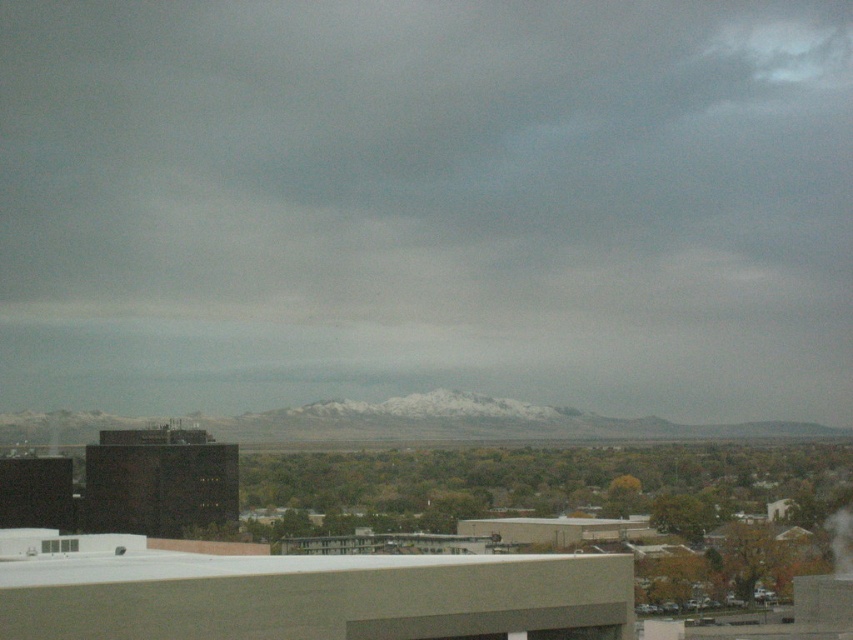
You are an urban planner analyzing the cityscape. You notice the gray cloudy sky at upper center and the white vapor at upper right in the image. Which of these two elements occupies a larger area in the scene?

The gray cloudy sky at upper center occupies a larger area than the white vapor at upper right, as its width is greater according to the description.

You are an airplane pilot preparing for takeoff and you notice the gray cloudy sky at upper center and the white vapor at upper right in the distance. Which object is located higher in the sky?

The gray cloudy sky at upper center is located higher in the sky than the white vapor at upper right.